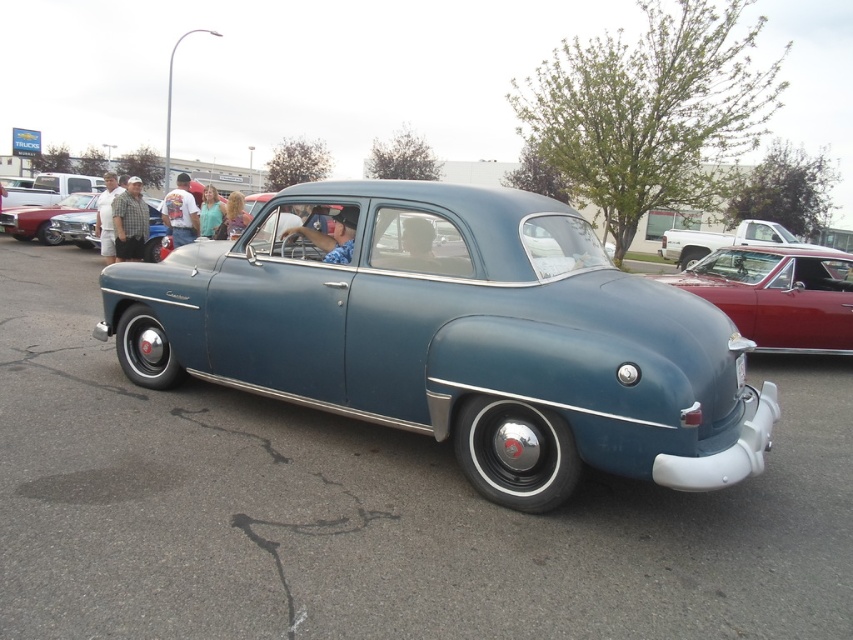
Question: Based on their relative distances, which object is farther from the metallic blue car at center?

Choices:
 (A) plaid shirt at left
 (B) white t-shirt at center
 (C) shiny red car at left
 (D) glossy red car at right

Answer: (C)

Question: Among these objects, which one is nearest to the camera?

Choices:
 (A) plaid shirt at left
 (B) denim shirt at center
 (C) shiny red car at left
 (D) white fabric shirt at left

Answer: (B)

Question: Is shiny red car at left to the left of plaid shirt at left from the viewer's perspective?

Choices:
 (A) yes
 (B) no

Answer: (A)

Question: Considering the relative positions of metallic blue car at center and white t-shirt at center in the image provided, where is metallic blue car at center located with respect to white t-shirt at center?

Choices:
 (A) above
 (B) below

Answer: (B)

Question: Is metallic blue car at center below shiny red car at left?

Choices:
 (A) yes
 (B) no

Answer: (A)

Question: Estimate the real-world distances between objects in this image. Which object is farther from the shiny red car at left?

Choices:
 (A) white t-shirt at center
 (B) blonde hair at center
 (C) glossy red car at right
 (D) plaid shirt at left

Answer: (C)